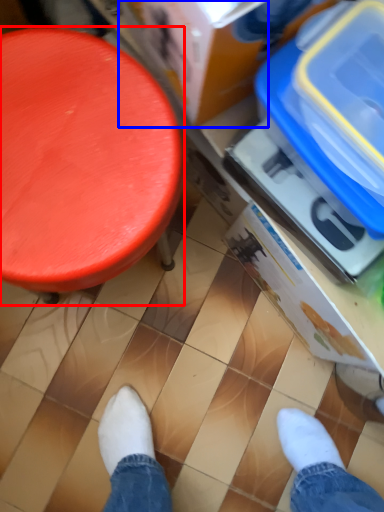
Question: Which point is further to the camera, furniture (highlighted by a red box) or storage box (highlighted by a blue box)?

Choices:
 (A) furniture
 (B) storage box

Answer: (A)